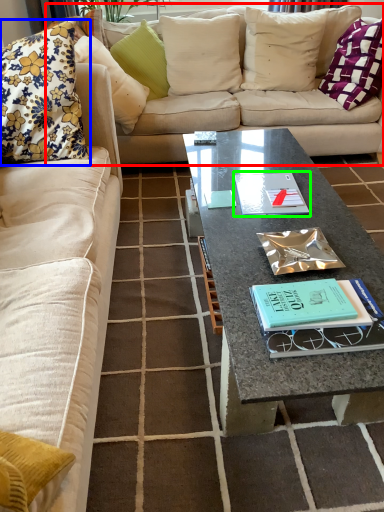
Question: Considering the real-world distances, which object is farthest from studio couch (highlighted by a red box)? pillow (highlighted by a blue box) or paperback book (highlighted by a green box)?

Choices:
 (A) pillow
 (B) paperback book

Answer: (B)